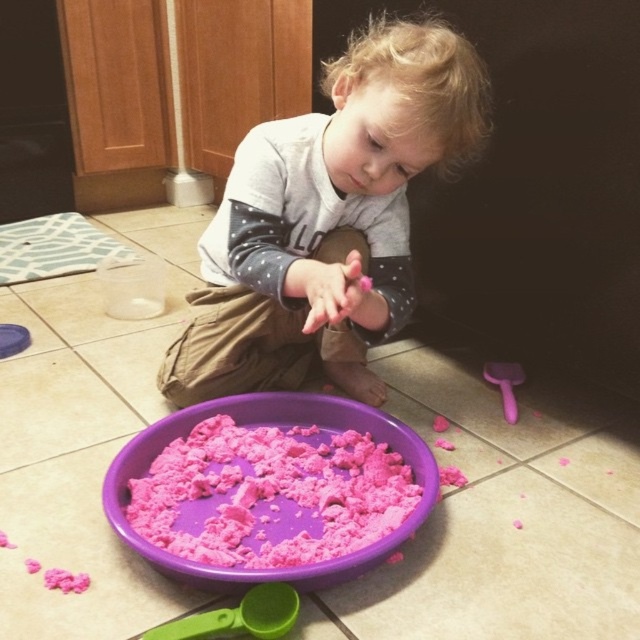
You are a parent observing your child playing with the matte gray shirt at center and the green plastic spoon at lower left. Which object is bigger in size?

The matte gray shirt at center has a larger size compared to the green plastic spoon at lower left, so the matte gray shirt at center is bigger.

You are a photographer trying to capture the child playing with the pink kinetic sand in the purple plastic tray. To ensure the matte gray shirt at center is visible in the photo, where should you position the camera relative to the shirt?

The matte gray shirt at center is located at point (326,220), so position the camera directly facing this coordinate to ensure the shirt is visible in the photo.

You are a parent trying to locate the purple plastic bowl at lower center in the image. According to the coordinates given, where would you find it?

The purple plastic bowl at lower center is located at the 2D coordinates point (280, 424).